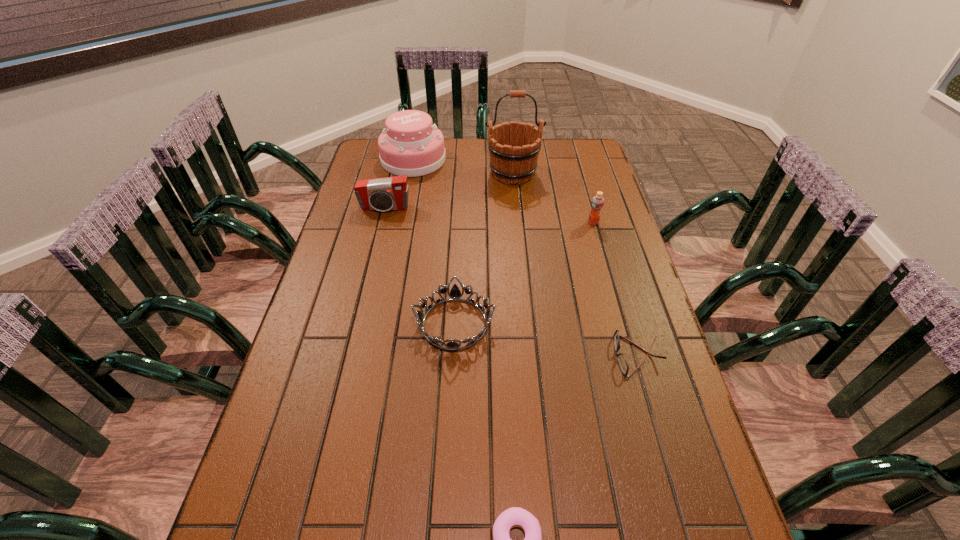
Identify the location of wine bucket. [x=513, y=159].

Locate an element on the screen. The height and width of the screenshot is (540, 960). the sixth shortest object is located at coordinates (411, 145).

This screenshot has width=960, height=540. I want to click on the fourth farthest object, so click(597, 203).

Where is `camera`? The width and height of the screenshot is (960, 540). camera is located at coordinates (389, 193).

Where is `the fifth tallest object`? This screenshot has width=960, height=540. the fifth tallest object is located at coordinates (455, 294).

Find the location of `spectacles`. spectacles is located at coordinates tap(621, 359).

Find the location of a particular element. The image size is (960, 540). vacant space located on the left of the wine bucket is located at coordinates (384, 173).

The width and height of the screenshot is (960, 540). What are the coordinates of `vacant area situated on the right of the sixth shortest object` in the screenshot? It's located at (482, 159).

Locate an element on the screen. free space located 0.240m on the left of the fourth farthest object is located at coordinates (515, 222).

The height and width of the screenshot is (540, 960). Find the location of `free spot located 0.350m on the front-facing side of the camera`. free spot located 0.350m on the front-facing side of the camera is located at coordinates (365, 292).